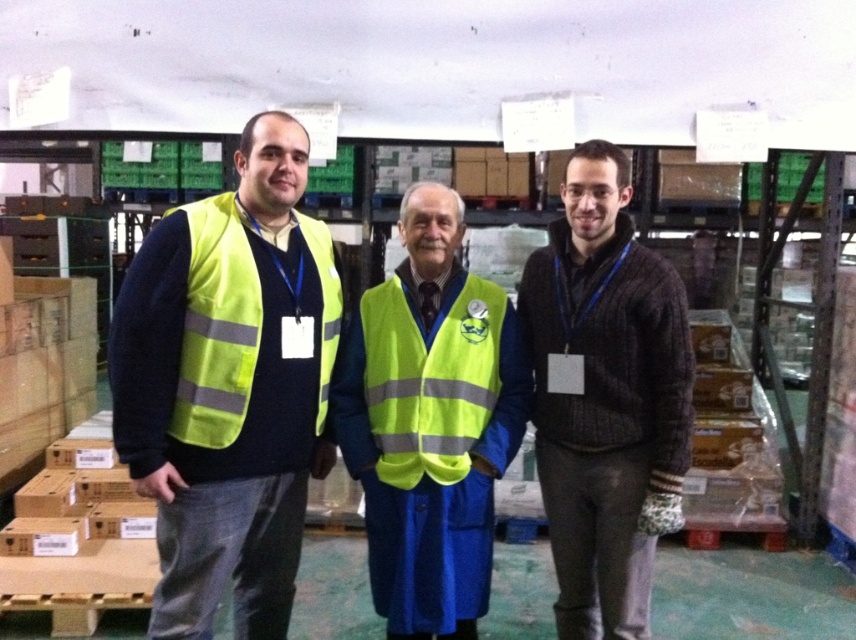
In the scene shown: Who is shorter, yellow reflective vest at center or knitted sweater at center?

Standing shorter between the two is knitted sweater at center.

Is point (171, 628) positioned in front of point (620, 412)?

Yes, it is in front of point (620, 412).

Does point (288, 468) come closer to viewer compared to point (586, 442)?

Yes, it is.

You are a GUI agent. You are given a task and a screenshot of the screen. Output one action in this format:
    pyautogui.click(x=<x>, y=<y>)
    Task: Click on the yellow reflective vest at center
    This screenshot has width=856, height=640.
    Given the screenshot: What is the action you would take?
    pyautogui.click(x=229, y=387)

What are the coordinates of `knitted sweater at center` in the screenshot? It's located at (605, 396).

Is point (596, 496) farther from viewer compared to point (474, 307)?

No, (596, 496) is closer to viewer.

Locate an element on the screen. knitted sweater at center is located at coordinates (605, 396).

Does high-visibility fabric vest at center have a lesser height compared to high-visibility fabric safety vest at left?

Incorrect, high-visibility fabric vest at center's height does not fall short of high-visibility fabric safety vest at left's.

Can you confirm if high-visibility fabric vest at center is taller than high-visibility fabric safety vest at left?

Yes, high-visibility fabric vest at center is taller than high-visibility fabric safety vest at left.

Locate an element on the screen. high-visibility fabric vest at center is located at coordinates (431, 422).